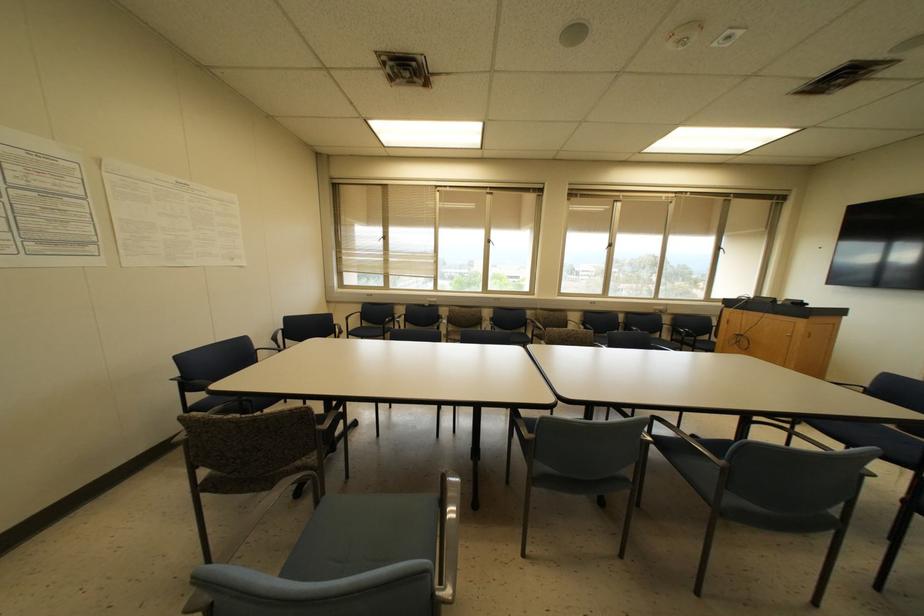
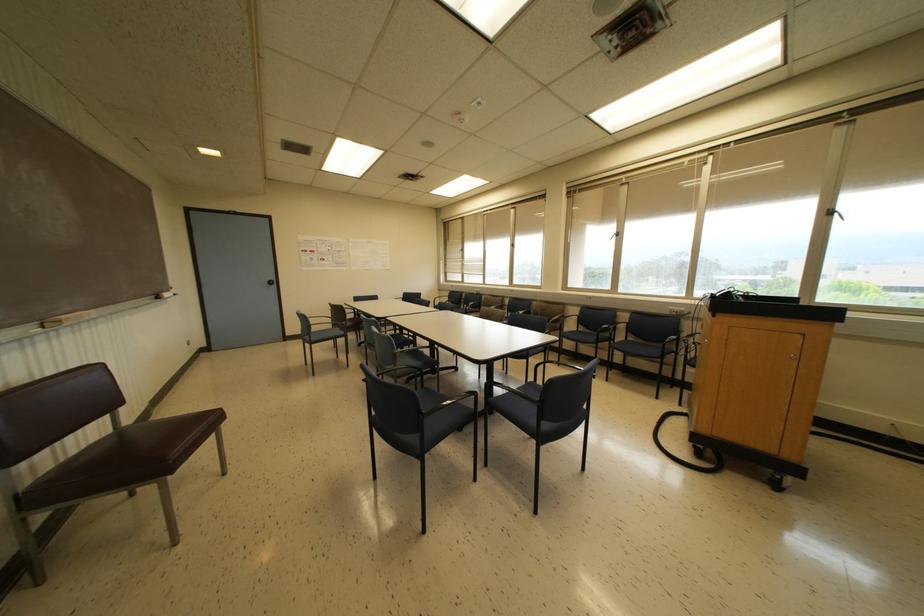
In the second image, find the point that corresponds to (x=610, y=245) in the first image.

(617, 233)